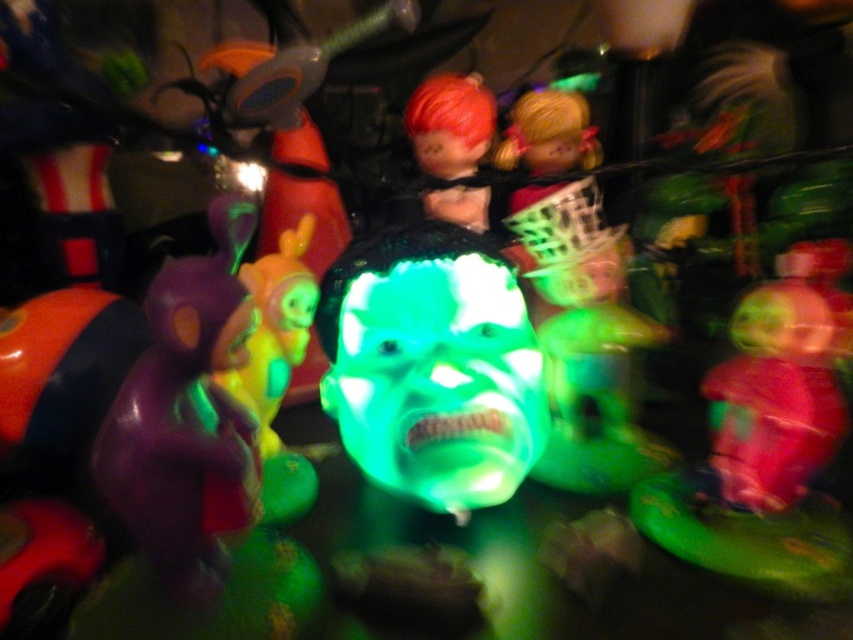
Question: Is green translucent mask at center to the left of shiny red hair at upper center from the viewer's perspective?

Choices:
 (A) no
 (B) yes

Answer: (B)

Question: Is the position of green translucent mask at center less distant than that of shiny red hair at upper center?

Choices:
 (A) no
 (B) yes

Answer: (B)

Question: Does green translucent mask at center have a lesser width compared to shiny red hair at upper center?

Choices:
 (A) yes
 (B) no

Answer: (B)

Question: Which of the following is the farthest from the observer?

Choices:
 (A) shiny red hair at upper center
 (B) green translucent mask at center

Answer: (A)

Question: Which of the following is the farthest from the observer?

Choices:
 (A) shiny red hair at upper center
 (B) green translucent mask at center

Answer: (A)